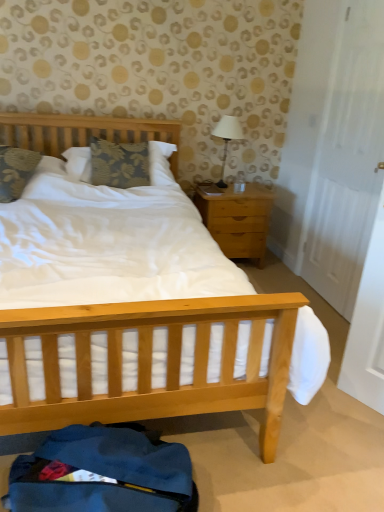
Question: Considering the positions of white matte door at right and floral fabric pillow at center, positioned as the first pillow in right-to-left order, in the image, is white matte door at right wider or thinner than floral fabric pillow at center, positioned as the first pillow in right-to-left order,?

Choices:
 (A) wide
 (B) thin

Answer: (B)

Question: Is white matte door at right to the left or to the right of floral fabric pillow at center, positioned as the first pillow in right-to-left order, in the image?

Choices:
 (A) left
 (B) right

Answer: (B)

Question: Which is farther from the light wood/texture nightstand at right?

Choices:
 (A) floral fabric pillow at center, positioned as the first pillow in right-to-left order
 (B) white matte door at right
 (C) floral fabric pillow at left, arranged as the second pillow when viewed from the right
 (D) white fabric-covered lamp at upper right

Answer: (C)

Question: Estimate the real-world distances between objects in this image. Which object is closer to the white matte door at right?

Choices:
 (A) floral fabric pillow at center, positioned as the 2th pillow in left-to-right order
 (B) light wood/texture nightstand at right
 (C) white fabric-covered lamp at upper right
 (D) floral fabric pillow at left, arranged as the second pillow when viewed from the right

Answer: (B)